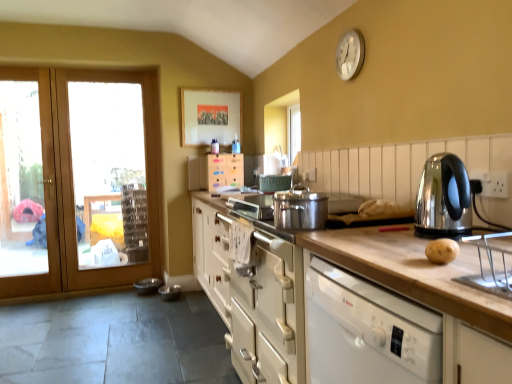
Question: Which direction should I rotate to look at white wood cabinet at center, the second cabinetry in the front-to-back sequence?

Choices:
 (A) right
 (B) left

Answer: (B)

Question: Is clear glass door at left thinner than white metallic clock at upper right?

Choices:
 (A) no
 (B) yes

Answer: (A)

Question: Is clear glass door at left beside white metallic clock at upper right?

Choices:
 (A) no
 (B) yes

Answer: (A)

Question: Is clear glass door at left closer to camera compared to white metallic clock at upper right?

Choices:
 (A) no
 (B) yes

Answer: (A)

Question: Does clear glass door at left have a lesser height compared to white metallic clock at upper right?

Choices:
 (A) no
 (B) yes

Answer: (A)

Question: Can you confirm if clear glass door at left is smaller than white metallic clock at upper right?

Choices:
 (A) no
 (B) yes

Answer: (A)

Question: From the image's perspective, is clear glass door at left below white metallic clock at upper right?

Choices:
 (A) no
 (B) yes

Answer: (B)

Question: From a real-world perspective, does matte wooden picture frame at upper center sit lower than white matte cabinet at center, the 1th cabinetry in the bottom-to-top sequence?

Choices:
 (A) no
 (B) yes

Answer: (A)

Question: Can you confirm if matte wooden picture frame at upper center is smaller than white matte cabinet at center, which ranks as the 1th cabinetry in front-to-back order?

Choices:
 (A) no
 (B) yes

Answer: (B)

Question: Is matte wooden picture frame at upper center to the right of white matte cabinet at center, which ranks as the 1th cabinetry in front-to-back order, from the viewer's perspective?

Choices:
 (A) no
 (B) yes

Answer: (A)

Question: Is matte wooden picture frame at upper center further to the viewer compared to white matte cabinet at center, the 2th cabinetry when ordered from back to front?

Choices:
 (A) no
 (B) yes

Answer: (B)

Question: Would you say matte wooden picture frame at upper center is a long distance from white matte cabinet at center, which ranks as the 1th cabinetry in front-to-back order?

Choices:
 (A) no
 (B) yes

Answer: (B)

Question: Does matte wooden picture frame at upper center turn towards white matte cabinet at center, which ranks as the 2th cabinetry in top-to-bottom order?

Choices:
 (A) yes
 (B) no

Answer: (B)

Question: Could you tell me if clear glass door at left is turned towards wooden door at left?

Choices:
 (A) yes
 (B) no

Answer: (A)